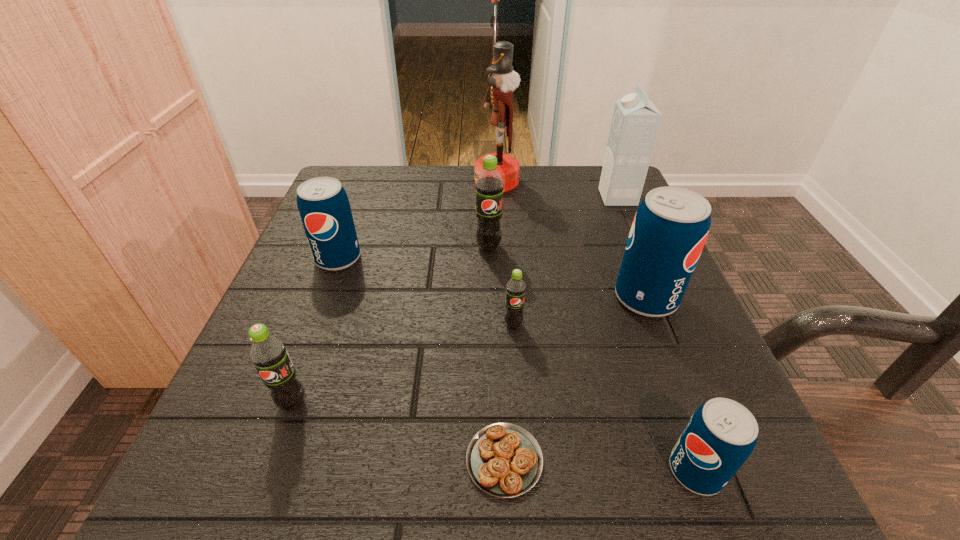
The height and width of the screenshot is (540, 960). I want to click on free space between the second tallest object and the third nearest object, so pos(455,300).

At what (x,y) coordinates should I click in order to perform the action: click on free spot between the second tallest object and the second nearest pop. Please return your answer as a coordinate pair (x, y). The height and width of the screenshot is (540, 960). Looking at the image, I should click on (455, 300).

Find the location of `vacant point located between the farthest blue pop and the red nutcracker`. vacant point located between the farthest blue pop and the red nutcracker is located at coordinates (418, 220).

Identify the location of empty location between the biggest blue pop and the shortest object. The height and width of the screenshot is (540, 960). (575, 379).

I want to click on unoccupied position between the nearest pop and the farthest blue pop, so click(516, 364).

At what (x,y) coordinates should I click in order to perform the action: click on unoccupied area between the second nearest green soda and the biggest blue pop. Please return your answer as a coordinate pair (x, y). Looking at the image, I should click on pyautogui.click(x=580, y=312).

Identify the location of free spot between the shortest object and the farthest blue pop. (421, 359).

This screenshot has width=960, height=540. Identify the location of the sixth closest object to the nearest pop. (635, 123).

The height and width of the screenshot is (540, 960). I want to click on object that can be found as the closest to the eighth shortest object, so click(503, 79).

Image resolution: width=960 pixels, height=540 pixels. What are the coordinates of `the fifth closest pop to the biggest green soda` in the screenshot? It's located at (720, 436).